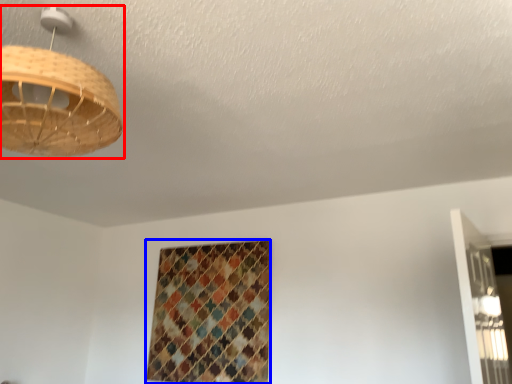
Question: Which object is further to the camera taking this photo, lamp (highlighted by a red box) or pattern (highlighted by a blue box)?

Choices:
 (A) lamp
 (B) pattern

Answer: (B)